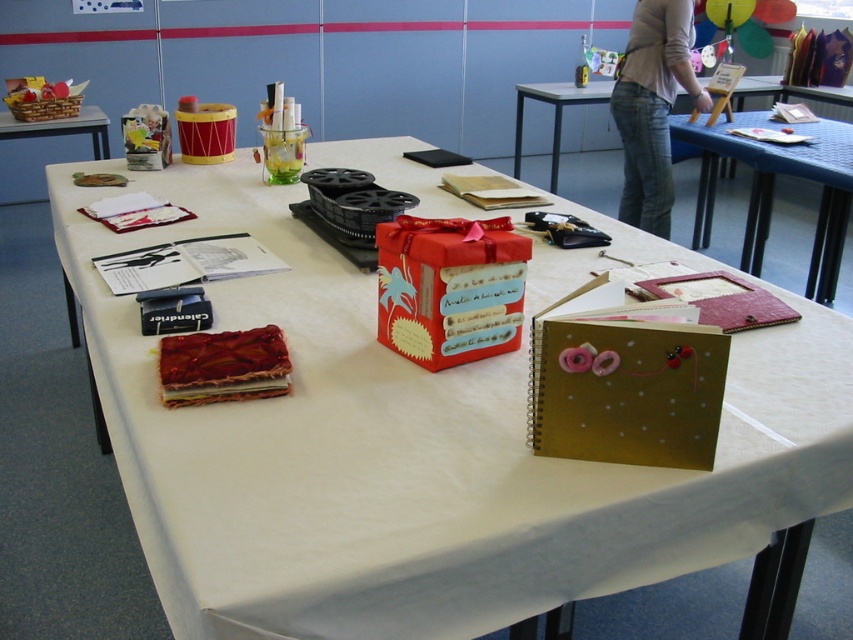
Question: Which of the following is the closest to the observer?

Choices:
 (A) wooden crate at left
 (B) blue fabric table at upper center

Answer: (A)

Question: Does gold textured notebook at center appear under wooden crate at left?

Choices:
 (A) yes
 (B) no

Answer: (A)

Question: Among these objects, which one is nearest to the camera?

Choices:
 (A) gold textured notebook at center
 (B) shiny red gift box at center

Answer: (B)

Question: Is gold textured notebook at center to the right of wooden crate at left from the viewer's perspective?

Choices:
 (A) no
 (B) yes

Answer: (B)

Question: Among these objects, which one is nearest to the camera?

Choices:
 (A) white fabric at center
 (B) shiny red gift box at center

Answer: (A)

Question: Where is shiny red gift box at center located in relation to wooden crate at left in the image?

Choices:
 (A) left
 (B) right

Answer: (B)